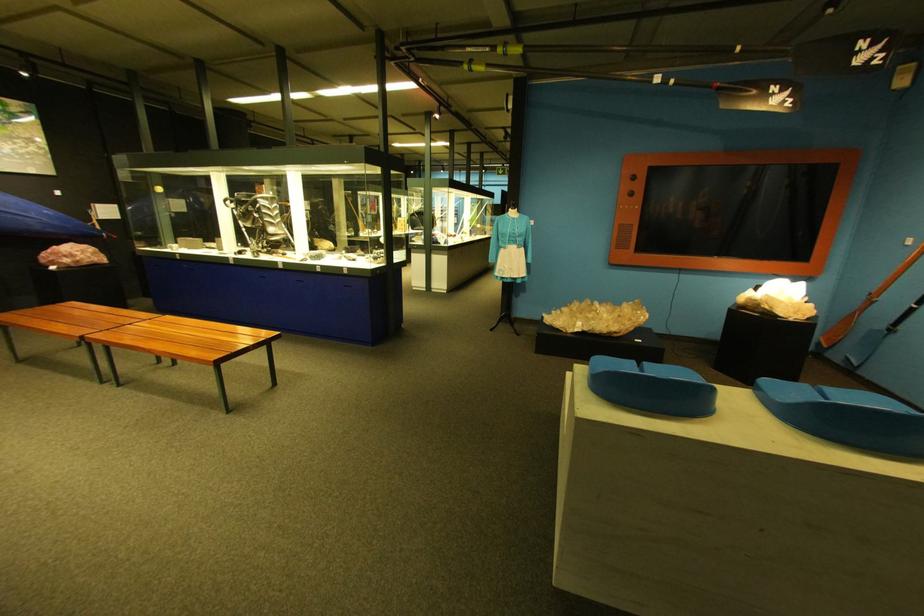
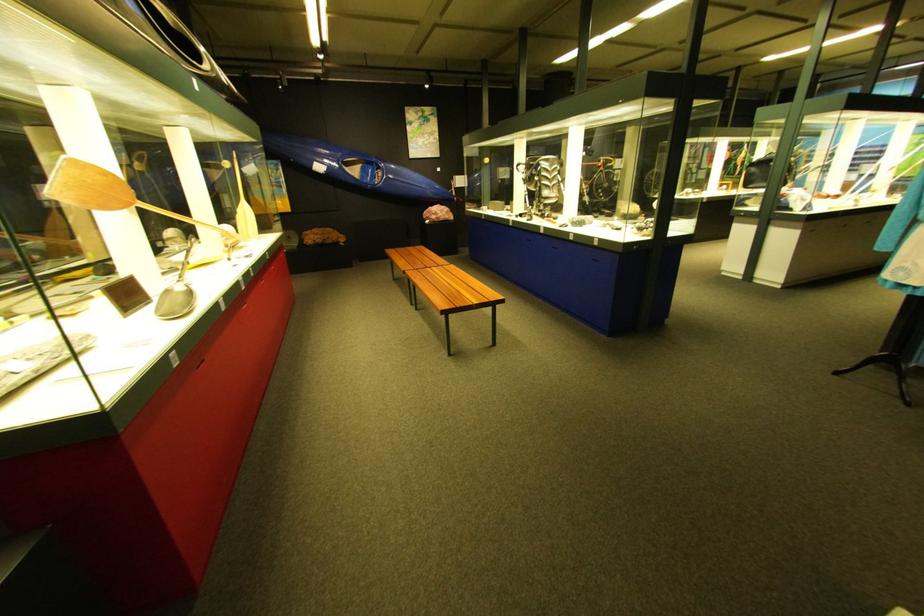
Where in the second image is the point corresponding to point (66, 310) from the first image?

(427, 251)